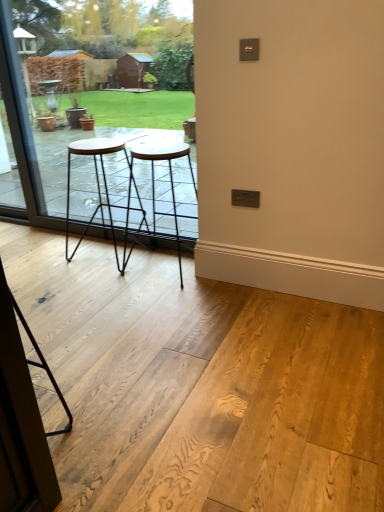
Question: Is black metal stool at center, the second stool from the left, to the left or to the right of transparent glass screen door at lower left in the image?

Choices:
 (A) right
 (B) left

Answer: (A)

Question: Is black metal stool at center, the second stool from the left, in front of or behind transparent glass screen door at lower left in the image?

Choices:
 (A) front
 (B) behind

Answer: (B)

Question: Estimate the real-world distances between objects in this image. Which object is closer to the transparent glass window at center?

Choices:
 (A) black metal stool at center, the second stool from the left
 (B) wooden stool at center, positioned as the 1th stool in left-to-right order
 (C) transparent glass screen door at lower left

Answer: (B)

Question: Which object is positioned closest to the transparent glass window at center?

Choices:
 (A) transparent glass screen door at lower left
 (B) black metal stool at center, the first stool when ordered from right to left
 (C) wooden stool at center, positioned as the 1th stool in left-to-right order

Answer: (C)